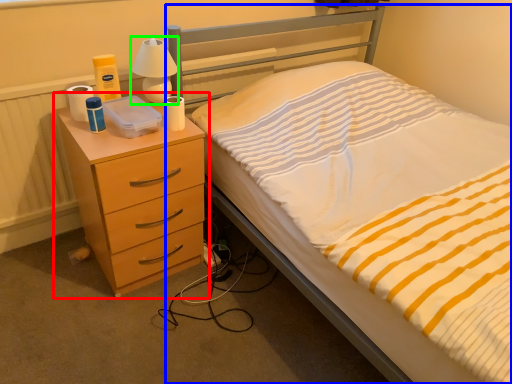
Question: Which object is the closest to the chest of drawers (highlighted by a red box)? Choose among these: bed (highlighted by a blue box) or bedside lamp (highlighted by a green box).

Choices:
 (A) bed
 (B) bedside lamp

Answer: (A)